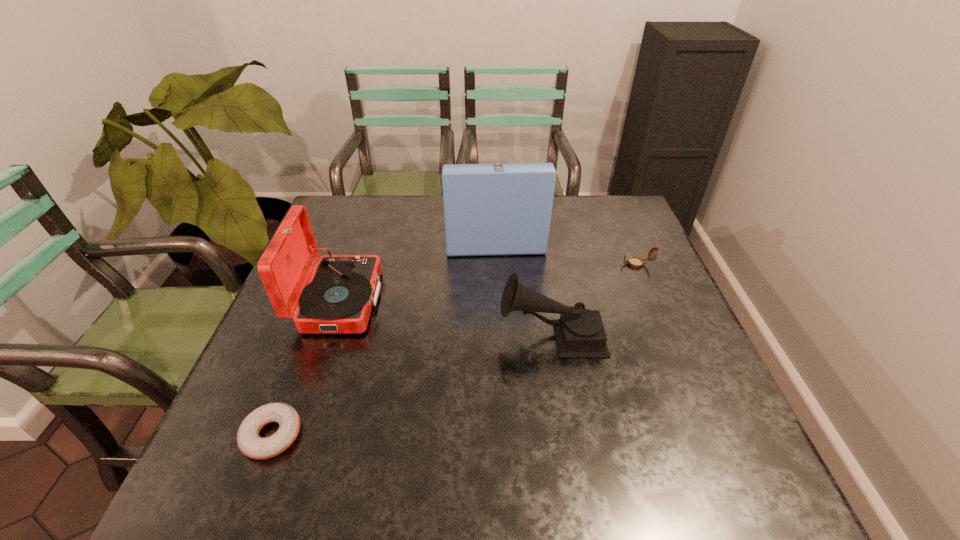
Where is `unoccupied area between the doughnut and the rightmost object`? The image size is (960, 540). unoccupied area between the doughnut and the rightmost object is located at coordinates (455, 349).

This screenshot has height=540, width=960. What are the coordinates of `object that is the closest to the leftmost phonograph_record` in the screenshot? It's located at (495, 209).

Select which object appears as the second closest to the third shortest object. Please provide its 2D coordinates. Your answer should be formatted as a tuple, i.e. [(x, y)], where the tuple contains the x and y coordinates of a point satisfying the conditions above.

[(495, 209)]

Find the location of a particular element. This screenshot has height=540, width=960. phonograph_record that stands as the second closest to the second farthest object is located at coordinates (579, 333).

Locate an element on the screen. the second closest phonograph_record to the fourth nearest object is located at coordinates (579, 333).

Identify the location of free spot that satisfies the following two spatial constraints: 1. on the face of the compass; 2. on the front side of the shortest object. The image size is (960, 540). click(x=710, y=435).